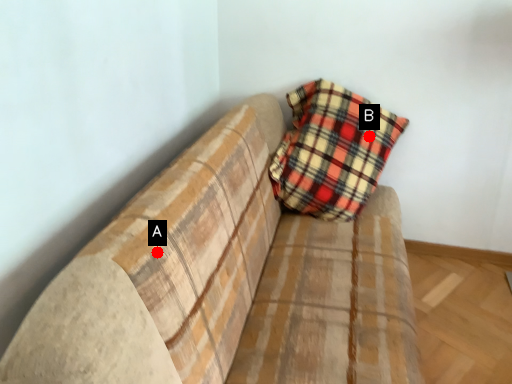
Question: Two points are circled on the image, labeled by A and B beside each circle. Which of the following is the closest to the observer?

Choices:
 (A) A is closer
 (B) B is closer

Answer: (A)